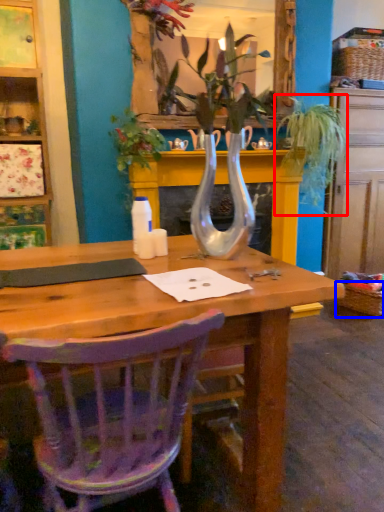
Question: Among these objects, which one is nearest to the camera, houseplant (highlighted by a red box) or picnic basket (highlighted by a blue box)?

Choices:
 (A) houseplant
 (B) picnic basket

Answer: (A)